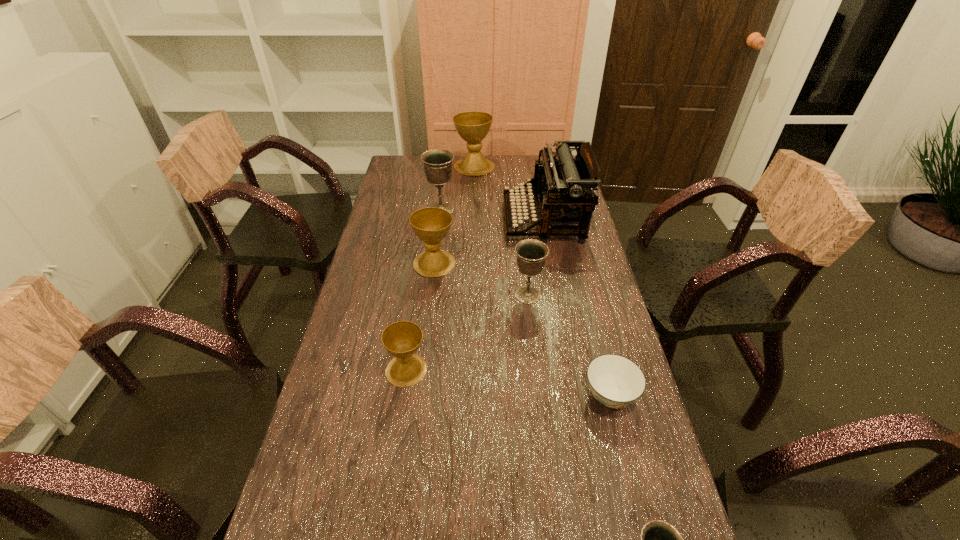
This screenshot has width=960, height=540. In order to click on empty location between the farthest chalice and the second chalice from right to left in this screenshot , I will do click(501, 231).

Identify the location of free space between the second smallest bronze chalice and the nearest brown chalice. (467, 333).

Locate an element on the screen. This screenshot has width=960, height=540. free space between the leftmost bronze chalice and the nearest brown chalice is located at coordinates (423, 290).

Locate an element on the screen. The height and width of the screenshot is (540, 960). unoccupied area between the smallest brown chalice and the second nearest bronze chalice is located at coordinates (467, 333).

Locate an element on the screen. Image resolution: width=960 pixels, height=540 pixels. free space that is in between the shortest object and the second bronze chalice from right to left is located at coordinates (569, 345).

Where is `the third closest object to the biggest brown chalice`? the third closest object to the biggest brown chalice is located at coordinates (431, 225).

At what (x,y) coordinates should I click in order to perform the action: click on the fifth closest object to the soup bowl. Please return your answer as a coordinate pair (x, y). Looking at the image, I should click on [x=566, y=185].

I want to click on chalice that is the fifth nearest to the rightmost bronze chalice, so click(x=473, y=127).

You are a GUI agent. You are given a task and a screenshot of the screen. Output one action in this format:
    pyautogui.click(x=<x>, y=<y>)
    Task: Click on the chalice that is the fourth closest to the second nearest chalice
    Image resolution: width=960 pixels, height=540 pixels.
    Given the screenshot: What is the action you would take?
    pyautogui.click(x=437, y=163)

Choose which brown chalice is the second nearest neighbor to the nearest brown chalice. Please provide its 2D coordinates. Your answer should be formatted as a tuple, i.e. [(x, y)], where the tuple contains the x and y coordinates of a point satisfying the conditions above.

[(473, 127)]